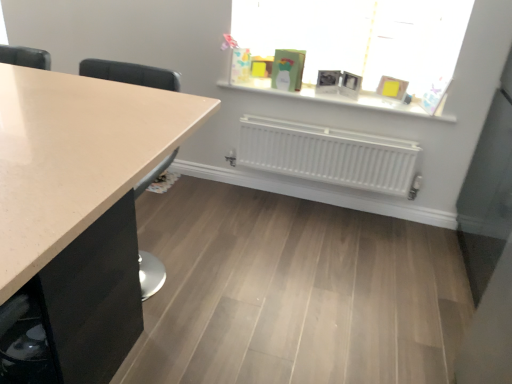
You are a GUI agent. You are given a task and a screenshot of the screen. Output one action in this format:
    pyautogui.click(x=<x>, y=<y>)
    Task: Click on the vacant region under matte beige countertop at left (from a real-world perspective)
    The height and width of the screenshot is (384, 512).
    Given the screenshot: What is the action you would take?
    pyautogui.click(x=155, y=261)